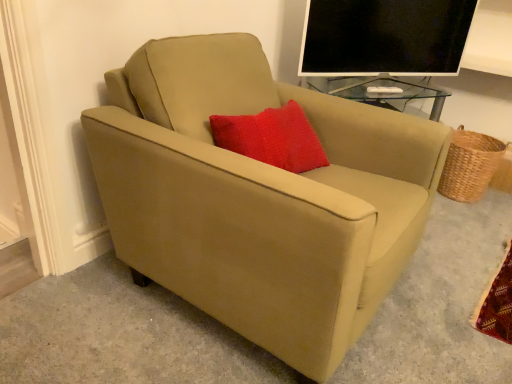
Image resolution: width=512 pixels, height=384 pixels. Describe the element at coordinates (260, 197) in the screenshot. I see `suede beige armchair at center` at that location.

Find the location of a particular element. black glossy monitor at upper right is located at coordinates click(x=385, y=37).

What's the angular difference between black glossy monitor at upper right and suede beige armchair at center's facing directions?

They differ by 37.2 degrees in their facing directions.

From a real-world perspective, which is physically below, black glossy monitor at upper right or suede beige armchair at center?

suede beige armchair at center is physically lower.

From the image's perspective, between black glossy monitor at upper right and suede beige armchair at center, which one is located above?

black glossy monitor at upper right.

Between black glossy monitor at upper right and suede beige armchair at center, which one is positioned behind?

black glossy monitor at upper right is further from the camera.

Looking at this image, how distant is black glossy monitor at upper right from woven brown basket at right?

black glossy monitor at upper right is 21.96 inches away from woven brown basket at right.

Consider the image. Is black glossy monitor at upper right situated inside woven brown basket at right or outside?

black glossy monitor at upper right is spatially situated outside woven brown basket at right.

Which object is closer to the camera taking this photo, black glossy monitor at upper right or woven brown basket at right?

black glossy monitor at upper right is closer to the camera.

From the image's perspective, which is below, black glossy monitor at upper right or woven brown basket at right?

From the image's view, woven brown basket at right is below.

Is woven brown basket at right at the back of suede beige armchair at center?

No, suede beige armchair at center is not facing away from woven brown basket at right.

From the picture: From the image's perspective, is suede beige armchair at center on woven brown basket at right?

No, from the image's perspective, suede beige armchair at center is not on top of woven brown basket at right.

Can you see suede beige armchair at center touching woven brown basket at right?

No, suede beige armchair at center is not with woven brown basket at right.

Does suede beige armchair at center lie in front of woven brown basket at right?

Yes.

Is point (191, 192) positioned behind point (459, 50)?

No.

Is suede beige armchair at center smaller than black glossy monitor at upper right?

No, suede beige armchair at center is not smaller than black glossy monitor at upper right.

Is the position of suede beige armchair at center more distant than that of black glossy monitor at upper right?

No.

Can you confirm if suede beige armchair at center is thinner than black glossy monitor at upper right?

No.

Is there a large distance between woven brown basket at right and suede beige armchair at center?

Yes, woven brown basket at right and suede beige armchair at center are located far from each other.

Considering the sizes of objects woven brown basket at right and suede beige armchair at center in the image provided, who is taller, woven brown basket at right or suede beige armchair at center?

suede beige armchair at center.

From a real-world perspective, is woven brown basket at right positioned above or below suede beige armchair at center?

In terms of real-world spatial position, woven brown basket at right is below suede beige armchair at center.

Which of these two, woven brown basket at right or black glossy monitor at upper right, is smaller?

woven brown basket at right.

The height and width of the screenshot is (384, 512). I want to click on basket below the black glossy monitor at upper right (from a real-world perspective), so [470, 165].

Which object is thinner, woven brown basket at right or black glossy monitor at upper right?

black glossy monitor at upper right is thinner.

Is point (478, 134) positioned behind point (314, 65)?

Yes, it is behind point (314, 65).

Where is `chair below the black glossy monitor at upper right (from the image's perspective)`? chair below the black glossy monitor at upper right (from the image's perspective) is located at coordinates (260, 197).

You are a GUI agent. You are given a task and a screenshot of the screen. Output one action in this format:
    pyautogui.click(x=<x>, y=<y>)
    Task: Click on the television above the woven brown basket at right (from a real-world perspective)
    Image resolution: width=512 pixels, height=384 pixels.
    Given the screenshot: What is the action you would take?
    pyautogui.click(x=385, y=37)

Considering their positions, is suede beige armchair at center positioned further to woven brown basket at right than black glossy monitor at upper right?

suede beige armchair at center is positioned further to the anchor woven brown basket at right.

Which object lies further to the anchor point suede beige armchair at center, black glossy monitor at upper right or woven brown basket at right?

Based on the image, woven brown basket at right appears to be further to suede beige armchair at center.

Based on the photo, which object lies nearer to the anchor point black glossy monitor at upper right, woven brown basket at right or suede beige armchair at center?

woven brown basket at right is positioned closer to the anchor black glossy monitor at upper right.

Looking at the image, which one is located closer to black glossy monitor at upper right, suede beige armchair at center or woven brown basket at right?

The object closer to black glossy monitor at upper right is woven brown basket at right.

Which object lies nearer to the anchor point suede beige armchair at center, woven brown basket at right or black glossy monitor at upper right?

Among the two, black glossy monitor at upper right is located nearer to suede beige armchair at center.

Estimate the real-world distances between objects in this image. Which object is further from woven brown basket at right, black glossy monitor at upper right or suede beige armchair at center?

Based on the image, suede beige armchair at center appears to be further to woven brown basket at right.

Image resolution: width=512 pixels, height=384 pixels. Find the location of `television between suede beige armchair at center and woven brown basket at right along the z-axis`. television between suede beige armchair at center and woven brown basket at right along the z-axis is located at coordinates (385, 37).